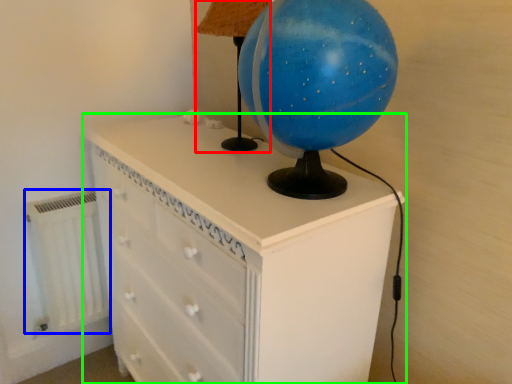
Question: Which object is positioned closest to table lamp (highlighted by a red box)? Select from radiator (highlighted by a blue box) and chest of drawers (highlighted by a green box).

Choices:
 (A) radiator
 (B) chest of drawers

Answer: (B)